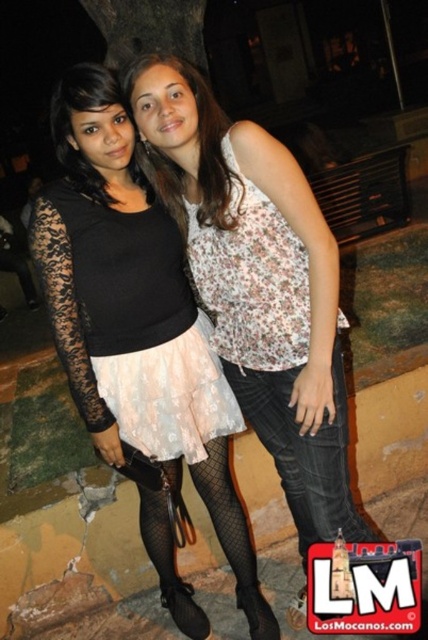
You are standing at a point in the image and want to move to the point labeled as point (110, 294). If your stride length is 0.75 meters per step, how many steps will you need to take to reach that point?

The distance between you and point (110, 294) is 2.05 meters. With each step covering 0.75 meters, you would need approximately 3 steps to reach the point. This is calculated by dividing 2.05 by 0.75, which equals approximately 2.73, so rounding up gives 3 steps.

You are taking a photo of two friends standing in a park at night. You notice two points marked in the image. One is at coordinate point (296, 352) and the other is at point (282, 454). Which point is closer to your camera lens?

Point (296, 352) is closer to the camera lens than point (282, 454).

You are a photographer trying to capture a closeup shot of the floral fabric top at center and the green rough bark at upper center. Which object should you zoom in on to ensure both are in frame without moving the camera?

The floral fabric top at center is wider than the green rough bark at upper center, so you should zoom in on the green rough bark at upper center to include both in the frame.